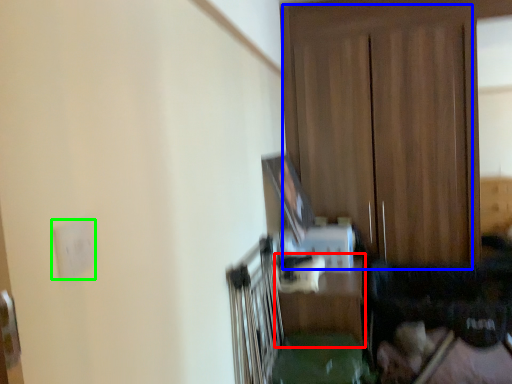
Question: Which object is positioned farthest from table (highlighted by a red box)? Select from dresser (highlighted by a blue box) and electric outlet (highlighted by a green box).

Choices:
 (A) dresser
 (B) electric outlet

Answer: (B)